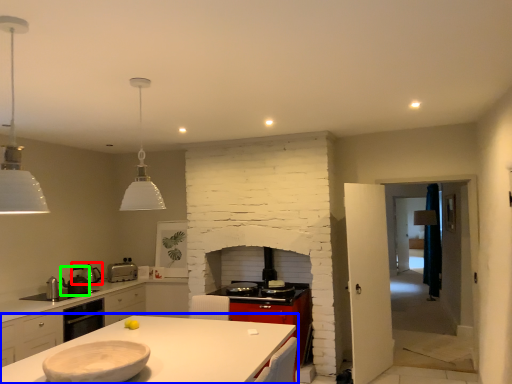
Question: Considering the real-world distances, which object is farthest from appliance (highlighted by a red box)? countertop (highlighted by a blue box) or appliance (highlighted by a green box)?

Choices:
 (A) countertop
 (B) appliance

Answer: (A)